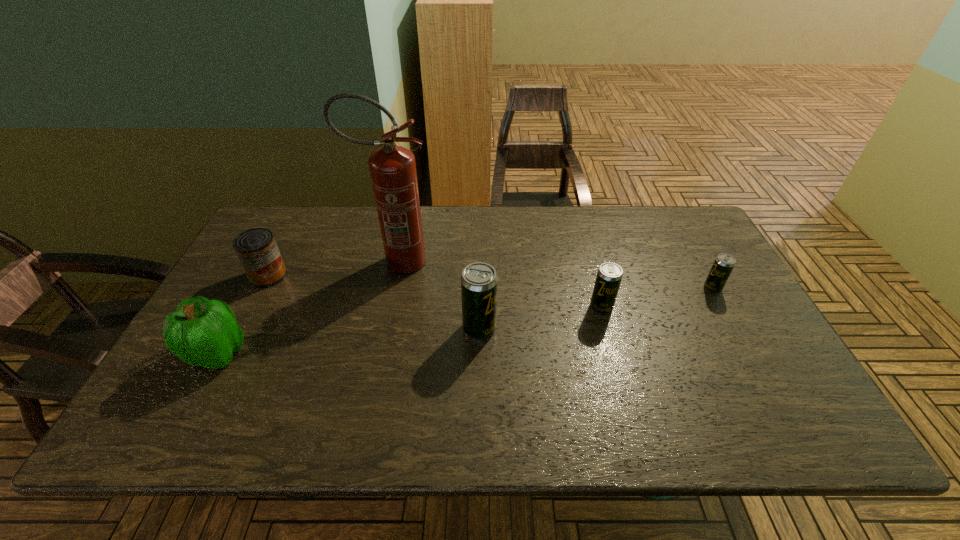
At what (x,y) coordinates should I click in order to perform the action: click on free space located on the right of the tallest beer can. Please return your answer as a coordinate pair (x, y). Looking at the image, I should click on (616, 328).

Locate an element on the screen. The width and height of the screenshot is (960, 540). vacant area situated 0.080m on the back of the second shortest beer can is located at coordinates (593, 279).

The image size is (960, 540). Identify the location of vacant space located on the front of the shortest object. (731, 321).

I want to click on free spot located 0.300m on the front of the can, so click(216, 378).

Where is `free point located 0.140m from the nozzle of the third object from left to right`? free point located 0.140m from the nozzle of the third object from left to right is located at coordinates (480, 262).

Identify the location of vacant space located on the back of the bell pepper. (251, 293).

You are a GUI agent. You are given a task and a screenshot of the screen. Output one action in this format:
    pyautogui.click(x=<x>, y=<y>)
    Task: Click on the object positioned at the far edge
    
    Given the screenshot: What is the action you would take?
    pyautogui.click(x=392, y=168)

Identify the location of object situated at the near edge. (202, 332).

The image size is (960, 540). What are the coordinates of `can located at the left edge` in the screenshot? It's located at (256, 248).

Where is `bell pepper at the left edge`? Image resolution: width=960 pixels, height=540 pixels. bell pepper at the left edge is located at coordinates (202, 332).